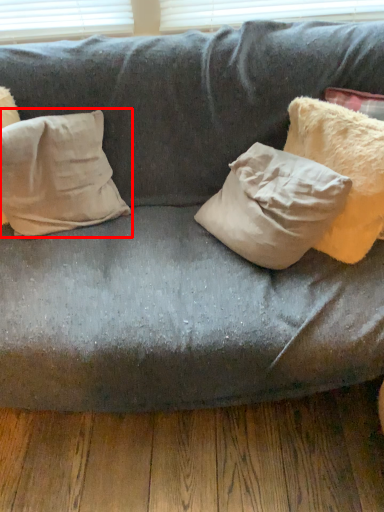
Question: From the image's perspective, what is the correct spatial relationship of pillow (annotated by the red box) in relation to pillow?

Choices:
 (A) below
 (B) above

Answer: (A)